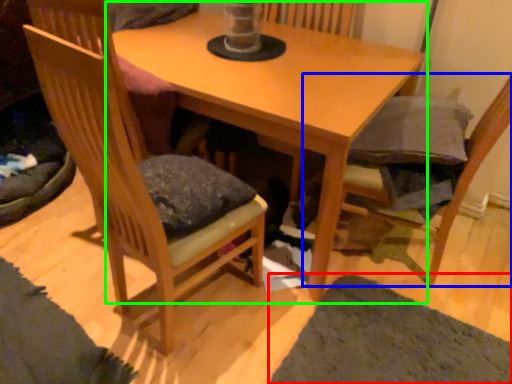
Question: Which object is the closest to the mat (highlighted by a red box)? Choose among these: chair (highlighted by a blue box) or table (highlighted by a green box).

Choices:
 (A) chair
 (B) table

Answer: (A)